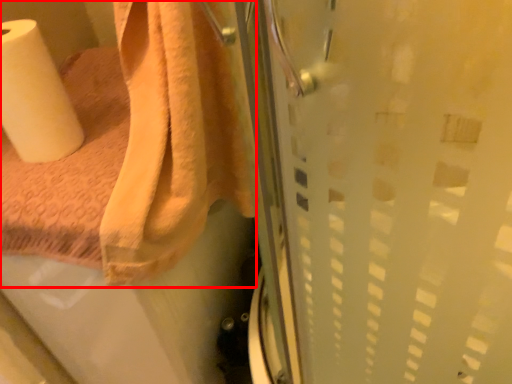
Question: From the image's perspective, where is towel (annotated by the red box) located relative to paper towel?

Choices:
 (A) above
 (B) below

Answer: (B)